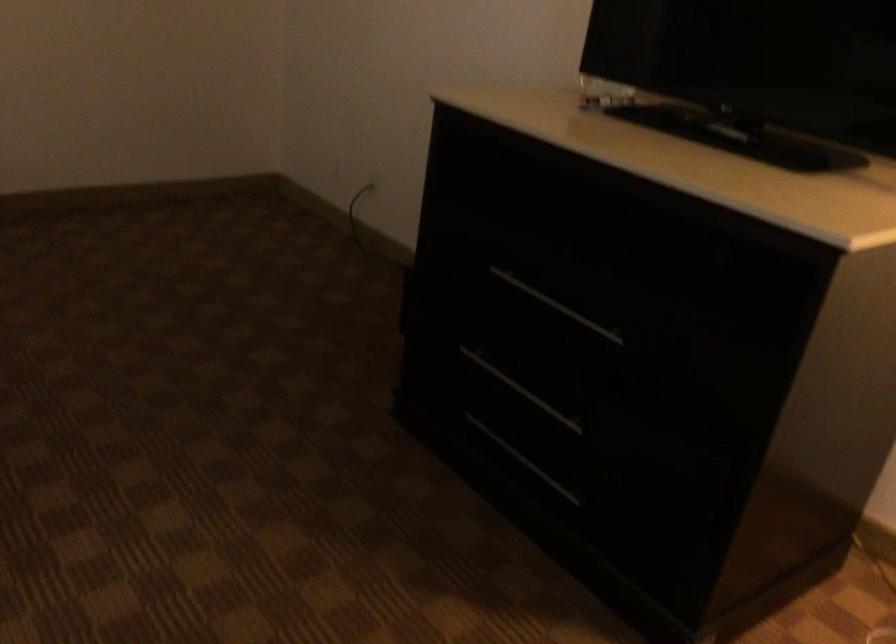
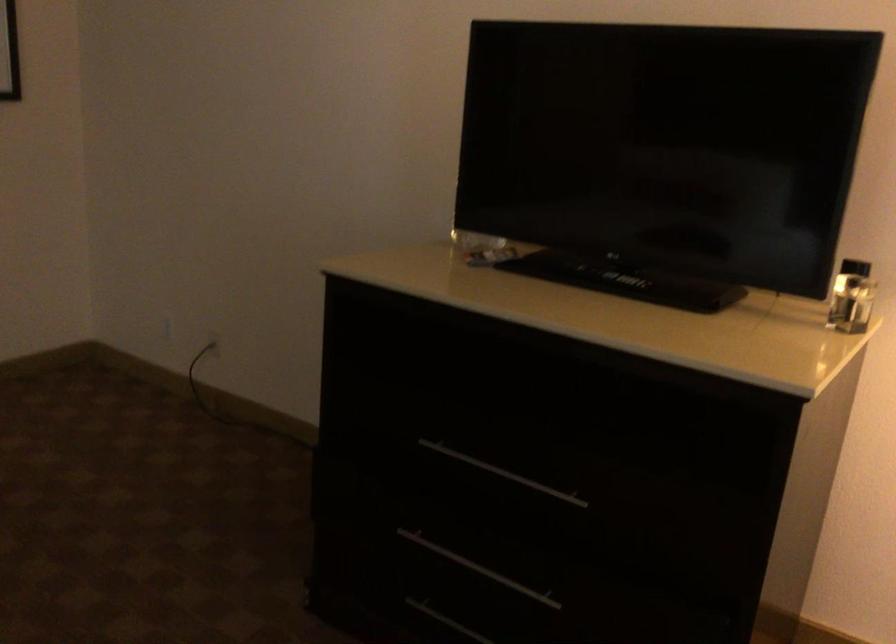
In the second image, find the point that corresponds to point 521,389 in the first image.

(478, 567)